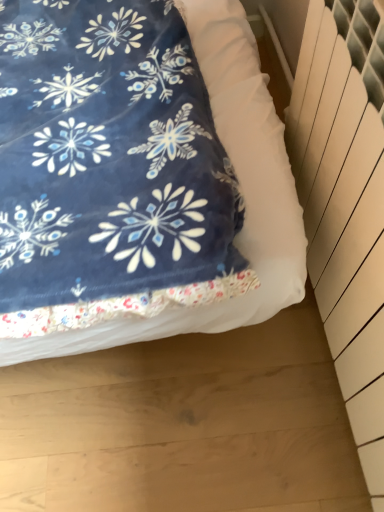
In order to click on white plastic radiator at right in this screenshot , I will do `click(344, 211)`.

Describe the element at coordinates (344, 211) in the screenshot. The height and width of the screenshot is (512, 384). I see `white plastic radiator at right` at that location.

The image size is (384, 512). Describe the element at coordinates (242, 191) in the screenshot. I see `velvety blue blanket at upper left` at that location.

You are a GUI agent. You are given a task and a screenshot of the screen. Output one action in this format:
    pyautogui.click(x=<x>, y=<y>)
    Task: Click on the velvety blue blanket at upper left
    The height and width of the screenshot is (512, 384).
    Given the screenshot: What is the action you would take?
    pyautogui.click(x=242, y=191)

The width and height of the screenshot is (384, 512). I want to click on white plastic radiator at right, so click(344, 211).

Considering the relative positions of white plastic radiator at right and velvety blue blanket at upper left in the image provided, is white plastic radiator at right to the right of velvety blue blanket at upper left from the viewer's perspective?

Yes, white plastic radiator at right is to the right of velvety blue blanket at upper left.

From the picture: Considering the positions of objects white plastic radiator at right and velvety blue blanket at upper left in the image provided, who is behind, white plastic radiator at right or velvety blue blanket at upper left?

Positioned behind is velvety blue blanket at upper left.

Is point (311, 270) closer to viewer compared to point (260, 105)?

No, it is not.

From the image's perspective, which one is positioned lower, white plastic radiator at right or velvety blue blanket at upper left?

white plastic radiator at right appears lower in the image.

From a real-world perspective, is white plastic radiator at right over velvety blue blanket at upper left?

Yes, from a real-world perspective, white plastic radiator at right is above velvety blue blanket at upper left.

Between white plastic radiator at right and velvety blue blanket at upper left, which one has smaller width?

With smaller width is white plastic radiator at right.

From their relative heights in the image, would you say white plastic radiator at right is taller or shorter than velvety blue blanket at upper left?

Considering their sizes, white plastic radiator at right has less height than velvety blue blanket at upper left.

Based on the photo, can you confirm if white plastic radiator at right is smaller than velvety blue blanket at upper left?

Yes, white plastic radiator at right is smaller than velvety blue blanket at upper left.

Is white plastic radiator at right inside the boundaries of velvety blue blanket at upper left, or outside?

The correct answer is: outside.

Is white plastic radiator at right not close to velvety blue blanket at upper left?

No.

From the picture: Is white plastic radiator at right facing towards velvety blue blanket at upper left?

Yes, white plastic radiator at right faces towards velvety blue blanket at upper left.

Based on the photo, how many degrees apart are the facing directions of white plastic radiator at right and velvety blue blanket at upper left?

There is a 88.1-degree angle between the facing directions of white plastic radiator at right and velvety blue blanket at upper left.

Locate an element on the screen. This screenshot has height=512, width=384. radiator that is above the velvety blue blanket at upper left (from a real-world perspective) is located at coordinates (344, 211).

Considering the relative positions of velvety blue blanket at upper left and white plastic radiator at right in the image provided, is velvety blue blanket at upper left to the right of white plastic radiator at right from the viewer's perspective?

No.

Between velvety blue blanket at upper left and white plastic radiator at right, which one is positioned in front?

white plastic radiator at right is in front.

Between point (296, 242) and point (323, 165), which one is positioned in front?

Point (296, 242)

From the image's perspective, who appears lower, velvety blue blanket at upper left or white plastic radiator at right?

white plastic radiator at right is shown below in the image.

From a real-world perspective, which object rests below the other?

velvety blue blanket at upper left is physically lower.

Can you confirm if velvety blue blanket at upper left is wider than white plastic radiator at right?

Indeed, velvety blue blanket at upper left has a greater width compared to white plastic radiator at right.

In the scene shown: Is velvety blue blanket at upper left shorter than white plastic radiator at right?

Incorrect, the height of velvety blue blanket at upper left does not fall short of that of white plastic radiator at right.

Considering the relative sizes of velvety blue blanket at upper left and white plastic radiator at right in the image provided, is velvety blue blanket at upper left smaller than white plastic radiator at right?

No.

Is velvety blue blanket at upper left outside of white plastic radiator at right?

Absolutely, velvety blue blanket at upper left is external to white plastic radiator at right.

Would you consider velvety blue blanket at upper left to be distant from white plastic radiator at right?

No, velvety blue blanket at upper left is in close proximity to white plastic radiator at right.

Is velvety blue blanket at upper left oriented towards white plastic radiator at right?

No, velvety blue blanket at upper left does not turn towards white plastic radiator at right.

This screenshot has height=512, width=384. There is a velvety blue blanket at upper left. What are the coordinates of `radiator above it (from a real-world perspective)` in the screenshot? It's located at (344, 211).

At what (x,y) coordinates should I click in order to perform the action: click on radiator in front of the velvety blue blanket at upper left. Please return your answer as a coordinate pair (x, y). Looking at the image, I should click on (344, 211).

At what (x,y) coordinates should I click in order to perform the action: click on bed on the left of white plastic radiator at right. Please return your answer as a coordinate pair (x, y). This screenshot has height=512, width=384. Looking at the image, I should click on (242, 191).